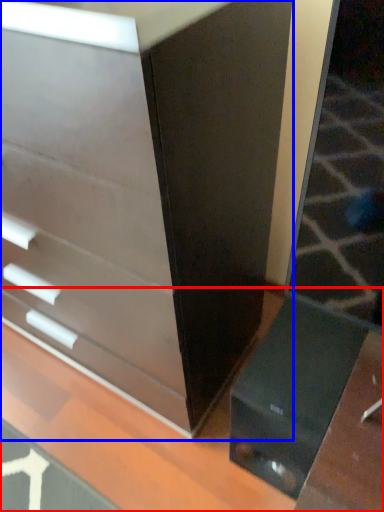
Question: Which point is further to the camera, table (highlighted by a red box) or chest of drawers (highlighted by a blue box)?

Choices:
 (A) table
 (B) chest of drawers

Answer: (B)